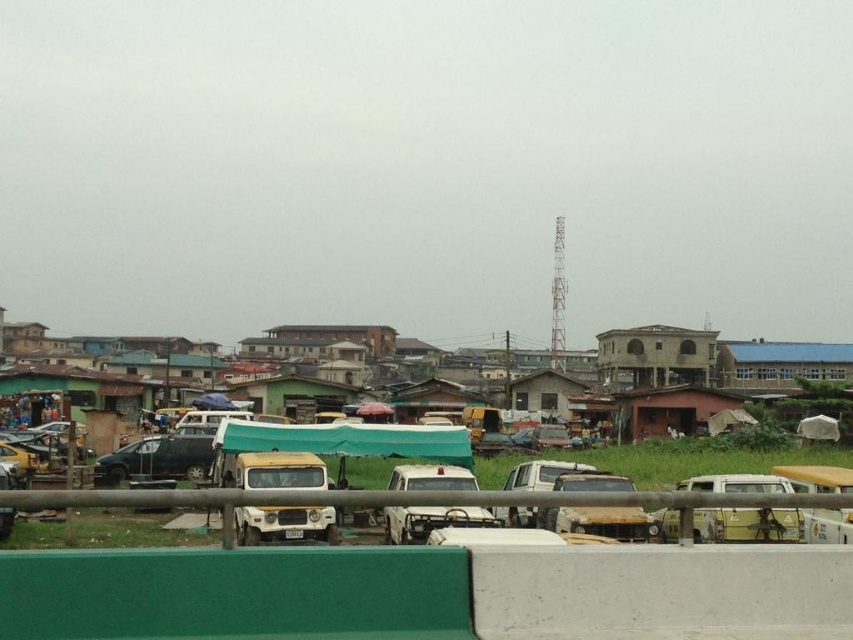
Image resolution: width=853 pixels, height=640 pixels. Describe the element at coordinates (700, 456) in the screenshot. I see `yellow matte truck at center` at that location.

Consider the image. Does yellow matte truck at center have a larger size compared to matte black car at center?

Indeed, yellow matte truck at center has a larger size compared to matte black car at center.

This screenshot has height=640, width=853. Describe the element at coordinates (700, 456) in the screenshot. I see `yellow matte truck at center` at that location.

This screenshot has width=853, height=640. I want to click on yellow matte truck at center, so click(700, 456).